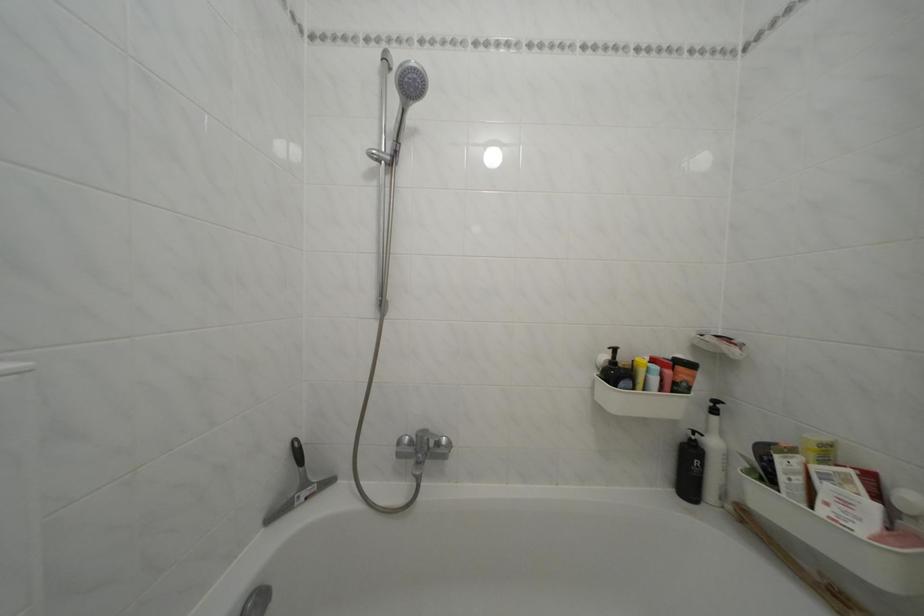
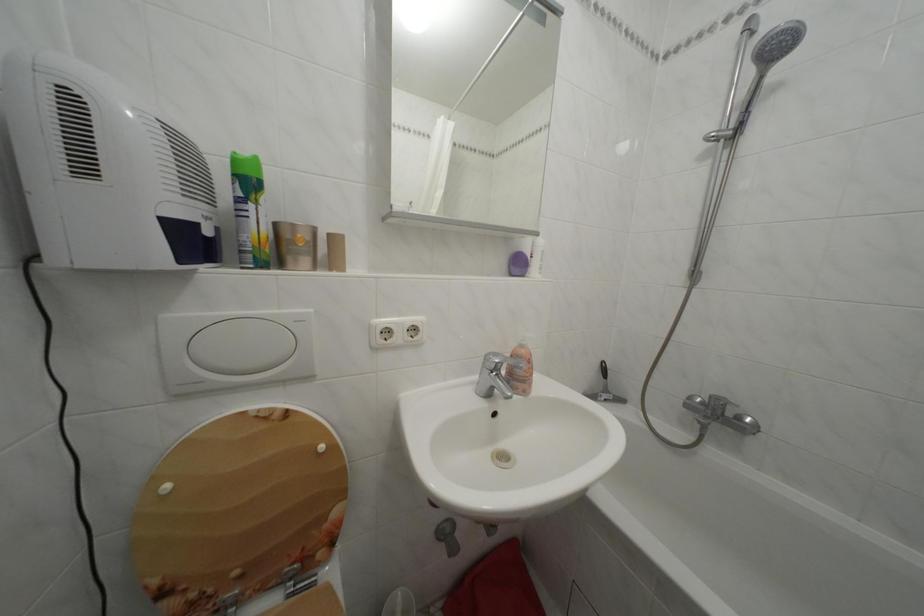
In the second image, find the point that corresponds to the point at 314,491 in the first image.

(614, 397)